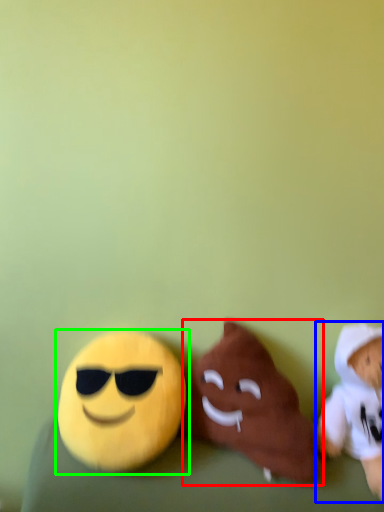
Question: Considering the real-world distances, which object is farthest from toy (highlighted by a red box)? toy (highlighted by a blue box) or toy (highlighted by a green box)?

Choices:
 (A) toy
 (B) toy

Answer: (A)